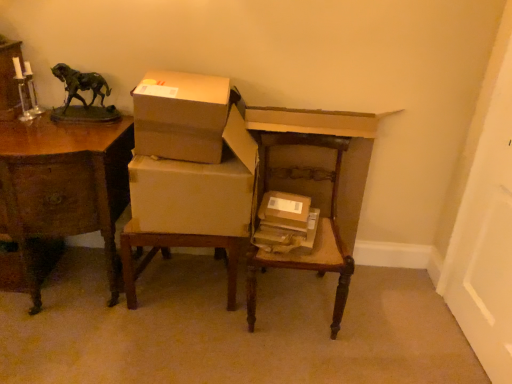
Question: From a real-world perspective, is brown cardboard box at center, which appears as the 2th box when viewed from the left, positioned over green patina bronze horse at upper left based on gravity?

Choices:
 (A) no
 (B) yes

Answer: (A)

Question: Is brown cardboard box at center, the first box when ordered from bottom to top, bigger than green patina bronze horse at upper left?

Choices:
 (A) yes
 (B) no

Answer: (B)

Question: Is green patina bronze horse at upper left inside brown cardboard box at center, positioned as the 1th box in right-to-left order?

Choices:
 (A) yes
 (B) no

Answer: (B)

Question: Does brown cardboard box at center, which appears as the 2th box when viewed from the left, come in front of green patina bronze horse at upper left?

Choices:
 (A) no
 (B) yes

Answer: (B)

Question: Is brown cardboard box at center, positioned as the 1th box in right-to-left order, shorter than green patina bronze horse at upper left?

Choices:
 (A) yes
 (B) no

Answer: (A)

Question: Visually, is green patina bronze horse at upper left positioned to the left or to the right of wooden chair at center?

Choices:
 (A) right
 (B) left

Answer: (B)

Question: Is point (70, 74) positioned closer to the camera than point (264, 220)?

Choices:
 (A) farther
 (B) closer

Answer: (A)

Question: From the image's perspective, is green patina bronze horse at upper left positioned above or below wooden chair at center?

Choices:
 (A) below
 (B) above

Answer: (B)

Question: Considering the positions of green patina bronze horse at upper left and wooden chair at center in the image, is green patina bronze horse at upper left wider or thinner than wooden chair at center?

Choices:
 (A) wide
 (B) thin

Answer: (B)

Question: Considering the positions of matte cardboard boxes at center and wooden chair at center in the image, is matte cardboard boxes at center bigger or smaller than wooden chair at center?

Choices:
 (A) small
 (B) big

Answer: (A)

Question: Which is correct: matte cardboard boxes at center is inside wooden chair at center, or outside of it?

Choices:
 (A) outside
 (B) inside

Answer: (A)

Question: Relative to wooden chair at center, is matte cardboard boxes at center in front or behind?

Choices:
 (A) behind
 (B) front

Answer: (A)

Question: From the image's perspective, is matte cardboard boxes at center located above or below wooden chair at center?

Choices:
 (A) above
 (B) below

Answer: (A)

Question: Considering their positions, is wooden desk at left located in front of or behind brown cardboard box at center, which ranks as the 2th box in top-to-bottom order?

Choices:
 (A) front
 (B) behind

Answer: (A)

Question: In terms of size, does wooden desk at left appear bigger or smaller than brown cardboard box at center, positioned as the 1th box in right-to-left order?

Choices:
 (A) small
 (B) big

Answer: (B)